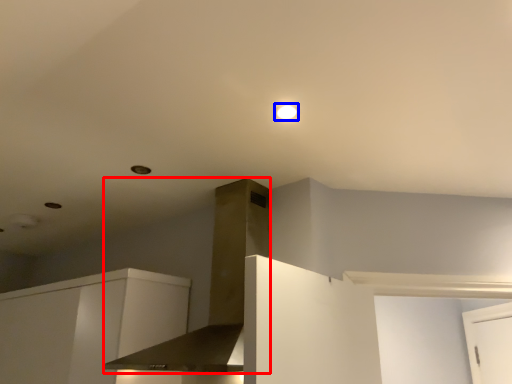
Question: Which object is further to the camera taking this photo, vent (highlighted by a red box) or lighting (highlighted by a blue box)?

Choices:
 (A) vent
 (B) lighting

Answer: (B)